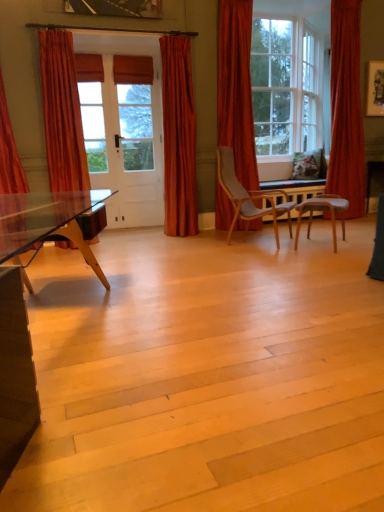
Question: From their relative heights in the image, would you say matte orange curtain at center, the 3th curtain in the right-to-left sequence, is taller or shorter than velvet orange curtain at left, which appears as the second curtain when viewed from the left?

Choices:
 (A) short
 (B) tall

Answer: (B)

Question: Is point (175, 211) positioned closer to the camera than point (79, 185)?

Choices:
 (A) farther
 (B) closer

Answer: (A)

Question: Estimate the real-world distances between objects in this image. Which object is farther from the light gray fabric chair at center, the second chair when ordered from right to left?

Choices:
 (A) velvet orange curtain at left, the fourth curtain viewed from the right
 (B) matte orange curtain at center, placed as the 3th curtain when sorted from left to right
 (C) velvet orange curtain at right, the first curtain from the right
 (D) velvet red curtain at left, placed as the first curtain when sorted from left to right
 (E) clear glass window at upper right

Answer: (D)

Question: Which of these objects is positioned closest to the matte orange curtain at center, placed as the 3th curtain when sorted from left to right?

Choices:
 (A) velvet red curtain at right, which appears as the 2th curtain when viewed from the right
 (B) velvet orange curtain at right, the first curtain from the right
 (C) light gray fabric chair at center right, which is the 2th chair from left to right
 (D) velvet orange curtain at left, the fourth curtain viewed from the right
 (E) light gray fabric chair at center, the second chair when ordered from right to left

Answer: (A)